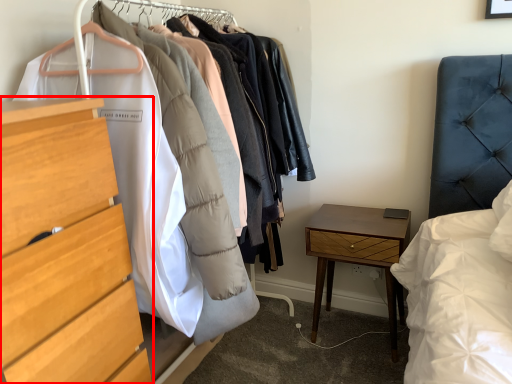
Question: Where is chest of drawers (annotated by the red box) located in relation to nightstand in the image?

Choices:
 (A) right
 (B) left

Answer: (B)